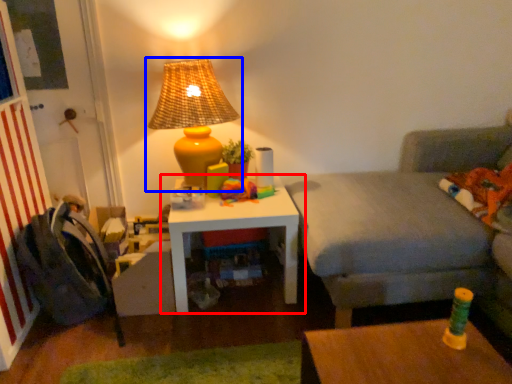
Question: Which of the following is the farthest to the observer, table (highlighted by a red box) or lamp (highlighted by a blue box)?

Choices:
 (A) table
 (B) lamp

Answer: (A)